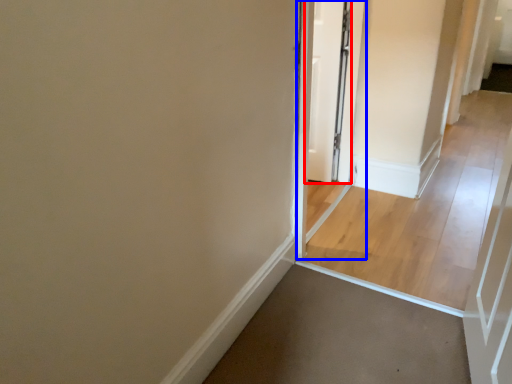
Question: Which object appears farthest to the camera in this image, door (highlighted by a red box) or screen door (highlighted by a blue box)?

Choices:
 (A) door
 (B) screen door

Answer: (A)